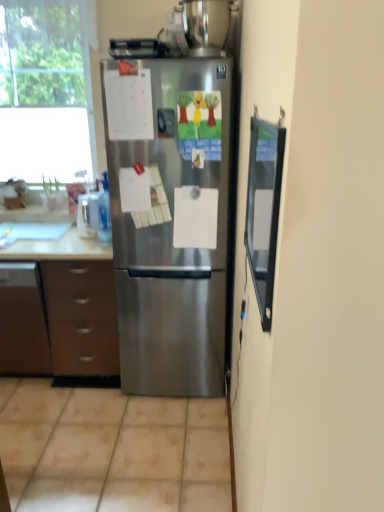
Question: Is point (124, 176) closer or farther from the camera than point (200, 1)?

Choices:
 (A) closer
 (B) farther

Answer: (B)

Question: From the image's perspective, is stainless steel refrigerator at center positioned above or below stainless steel pot at upper center, which is the 1th appliance in right-to-left order?

Choices:
 (A) above
 (B) below

Answer: (B)

Question: Which is farther from the beige tile at lower center?

Choices:
 (A) satin silver refrigerator at upper center, marked as the first appliance in a left-to-right arrangement
 (B) stainless steel pot at upper center, marked as the second appliance in a left-to-right arrangement
 (C) brown matte cabinet at lower left
 (D) stainless steel refrigerator at center
 (E) white glossy sink at left

Answer: (B)

Question: Which of these objects is positioned farthest from the stainless steel refrigerator at center?

Choices:
 (A) transparent glass screen door at right
 (B) white glossy sink at left
 (C) satin silver refrigerator at upper center, placed as the second appliance when sorted from right to left
 (D) transparent glass window at upper left
 (E) beige tile at lower center

Answer: (A)